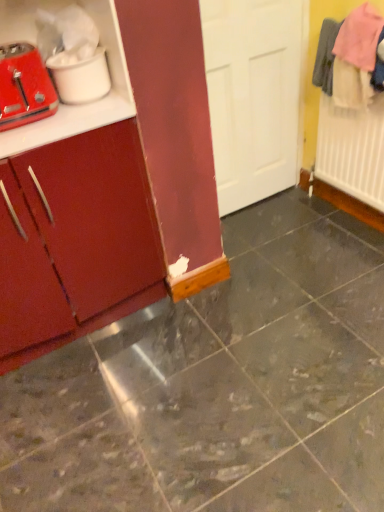
Question: From a real-world perspective, is matte white toaster at left positioned above or below matte wood cabinet at left?

Choices:
 (A) above
 (B) below

Answer: (A)

Question: From the image's perspective, is matte white toaster at left positioned above or below matte wood cabinet at left?

Choices:
 (A) above
 (B) below

Answer: (A)

Question: Estimate the real-world distances between objects in this image. Which object is closer to the matte white toaster at left?

Choices:
 (A) marble tile floor at center
 (B) matte red toaster at left
 (C) matte wood cabinet at left

Answer: (B)

Question: Estimate the real-world distances between objects in this image. Which object is farther from the marble tile floor at center?

Choices:
 (A) matte wood cabinet at left
 (B) matte white toaster at left
 (C) matte red toaster at left

Answer: (B)